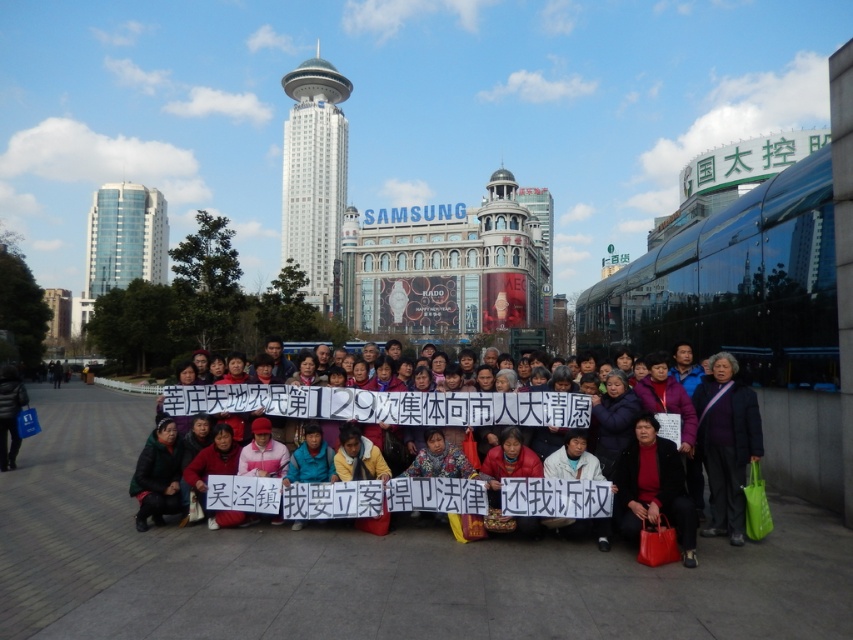
Question: In this image, where is multicolored fabric banner at center located relative to white glass tower at center?

Choices:
 (A) left
 (B) right

Answer: (B)

Question: Considering the relative positions of white glass tower at center and glassy blue skyscraper at upper left in the image provided, where is white glass tower at center located with respect to glassy blue skyscraper at upper left?

Choices:
 (A) above
 (B) below

Answer: (A)

Question: Which object is positioned closest to the white glass tower at center?

Choices:
 (A) glassy blue skyscraper at upper left
 (B) multicolored fabric banner at center

Answer: (A)

Question: Which object appears closest to the camera in this image?

Choices:
 (A) white glass tower at center
 (B) multicolored fabric banner at center

Answer: (B)

Question: Is multicolored fabric banner at center wider than white glass tower at center?

Choices:
 (A) no
 (B) yes

Answer: (B)

Question: Which point is closer to the camera taking this photo?

Choices:
 (A) (254, 392)
 (B) (106, 186)

Answer: (A)